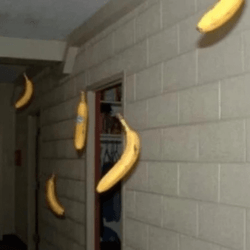
The image size is (250, 250). I want to click on coat hanger hanging in closet, so click(x=108, y=155), click(x=117, y=153).